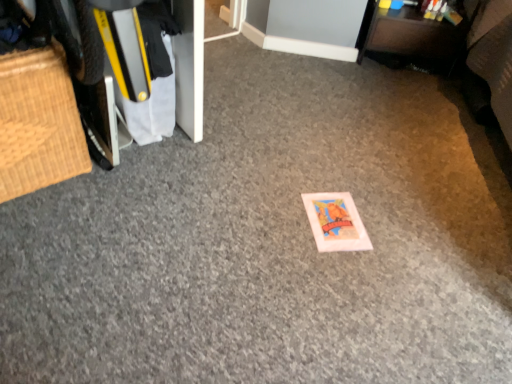
Question: From a real-world perspective, is brown fabric drawer at upper right, the second furniture when ordered from left to right, physically above bamboo mat at left, positioned as the 2th furniture in right-to-left order?

Choices:
 (A) no
 (B) yes

Answer: (A)

Question: Is brown fabric drawer at upper right, the second furniture when ordered from left to right, to the right of bamboo mat at left, positioned as the 2th furniture in right-to-left order, from the viewer's perspective?

Choices:
 (A) no
 (B) yes

Answer: (B)

Question: From a real-world perspective, does brown fabric drawer at upper right, which is counted as the 2th furniture, starting from the front, sit lower than bamboo mat at left, the second furniture in the top-to-bottom sequence?

Choices:
 (A) yes
 (B) no

Answer: (A)

Question: From the image's perspective, is brown fabric drawer at upper right, the second furniture when ordered from left to right, beneath bamboo mat at left, marked as the 1th furniture in a left-to-right arrangement?

Choices:
 (A) no
 (B) yes

Answer: (A)

Question: Is brown fabric drawer at upper right, arranged as the first furniture when viewed from the top, completely or partially outside of bamboo mat at left, marked as the 2th furniture in a back-to-front arrangement?

Choices:
 (A) no
 (B) yes

Answer: (B)

Question: Is brown fabric drawer at upper right, which is counted as the 2th furniture, starting from the front, beside bamboo mat at left, which ranks as the first furniture in front-to-back order?

Choices:
 (A) yes
 (B) no

Answer: (B)

Question: Can you confirm if bamboo mat at left, which ranks as the first furniture in bottom-to-top order, is positioned to the left of brown fabric drawer at upper right, the 2th furniture in the bottom-to-top sequence?

Choices:
 (A) no
 (B) yes

Answer: (B)

Question: From the image's perspective, is bamboo mat at left, which ranks as the first furniture in front-to-back order, above brown fabric drawer at upper right, the 2th furniture in the bottom-to-top sequence?

Choices:
 (A) no
 (B) yes

Answer: (A)

Question: From the image's perspective, is bamboo mat at left, which ranks as the first furniture in front-to-back order, below brown fabric drawer at upper right, the second furniture when ordered from left to right?

Choices:
 (A) yes
 (B) no

Answer: (A)

Question: Is bamboo mat at left, the second furniture in the top-to-bottom sequence, outside brown fabric drawer at upper right, which is counted as the 2th furniture, starting from the front?

Choices:
 (A) yes
 (B) no

Answer: (A)

Question: Is bamboo mat at left, which ranks as the first furniture in front-to-back order, positioned in front of brown fabric drawer at upper right, the 2th furniture in the bottom-to-top sequence?

Choices:
 (A) no
 (B) yes

Answer: (B)

Question: Are bamboo mat at left, which ranks as the first furniture in bottom-to-top order, and brown fabric drawer at upper right, arranged as the first furniture when viewed from the back, making contact?

Choices:
 (A) no
 (B) yes

Answer: (A)

Question: From a real-world perspective, is bamboo mat at left, positioned as the 2th furniture in right-to-left order, physically located above or below brown fabric drawer at upper right, arranged as the first furniture when viewed from the top?

Choices:
 (A) above
 (B) below

Answer: (A)